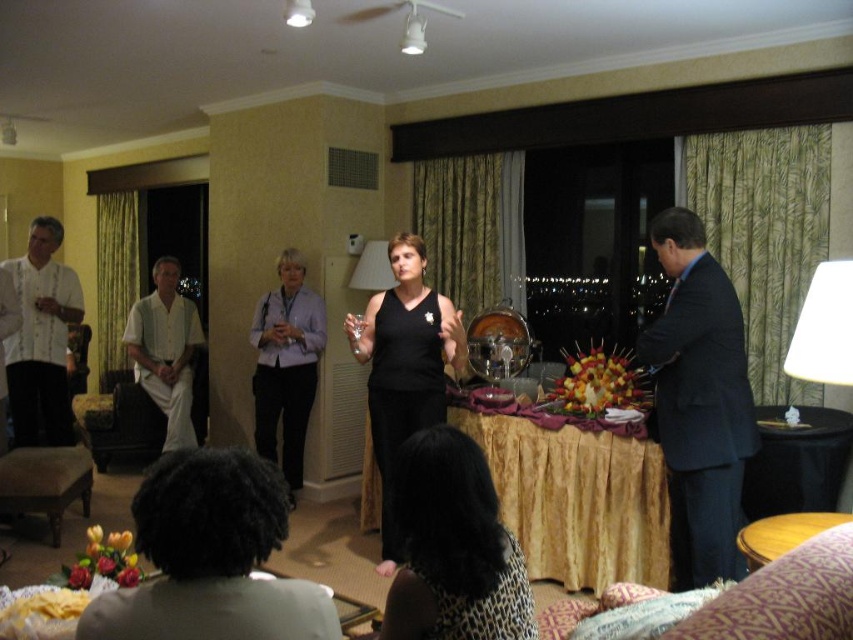
Question: Estimate the real-world distances between objects in this image. Which object is farther from the dark gray shirt at lower left?

Choices:
 (A) wooden table at lower right
 (B) dark blue suit at right
 (C) white cotton shirt at left

Answer: (C)

Question: In this image, where is dark blue suit at right located relative to white embroidered shirt at left?

Choices:
 (A) below
 (B) above

Answer: (A)

Question: Is white embroidered shirt at left thinner than light purple shirt at center?

Choices:
 (A) no
 (B) yes

Answer: (B)

Question: Is light purple shirt at center below white cotton shirt at left?

Choices:
 (A) yes
 (B) no

Answer: (A)

Question: Which object is the closest to the white cotton shirt at left?

Choices:
 (A) dark blue suit at right
 (B) dark gray shirt at lower left
 (C) leopard print dress at center
 (D) wooden table at lower right

Answer: (A)

Question: Considering the real-world distances, which object is farthest from the gold fabric table at center?

Choices:
 (A) black matte dress at center
 (B) leopard print dress at center
 (C) wooden table at lower right

Answer: (B)